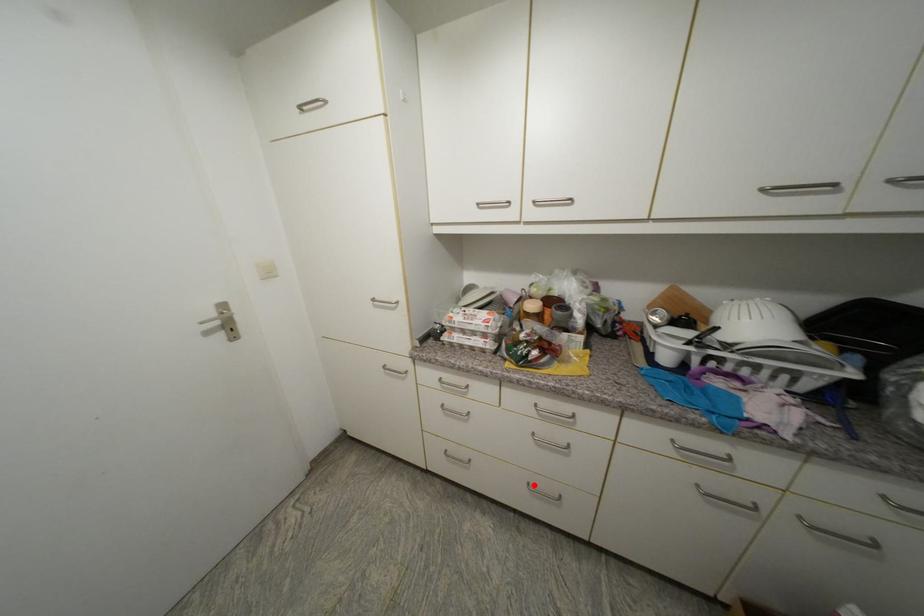
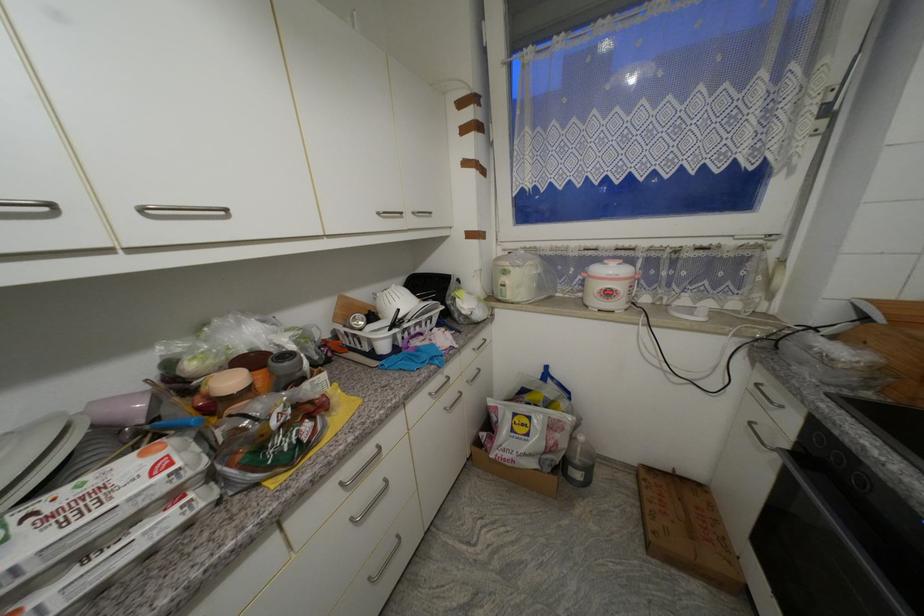
In the second image, find the point that corresponds to the highlighted location in the first image.

(375, 581)